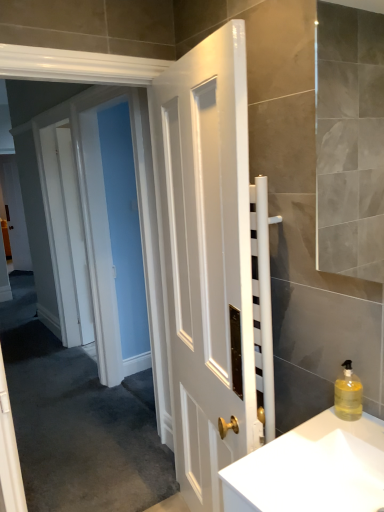
Question: Considering the positions of white glossy sink at lower right and translucent yellow liquid at right in the image, is white glossy sink at lower right bigger or smaller than translucent yellow liquid at right?

Choices:
 (A) small
 (B) big

Answer: (B)

Question: Considering the positions of white glossy sink at lower right and translucent yellow liquid at right in the image, is white glossy sink at lower right taller or shorter than translucent yellow liquid at right?

Choices:
 (A) tall
 (B) short

Answer: (B)

Question: Based on their relative distances, which object is nearer to the translucent yellow liquid at right?

Choices:
 (A) white glossy door at left
 (B) white glossy sink at lower right

Answer: (B)

Question: Considering the real-world distances, which object is farthest from the translucent yellow liquid at right?

Choices:
 (A) white glossy door at left
 (B) white glossy sink at lower right

Answer: (A)